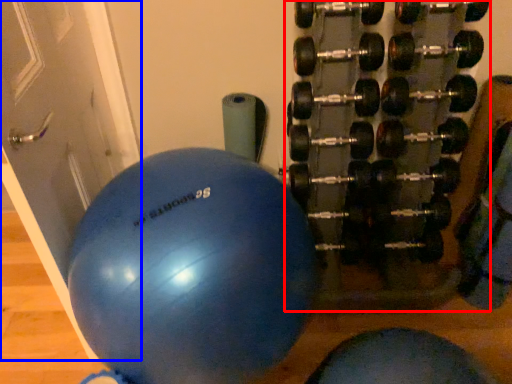
Question: Which point is further to the camera, dumbbell (highlighted by a red box) or door (highlighted by a blue box)?

Choices:
 (A) dumbbell
 (B) door

Answer: (A)